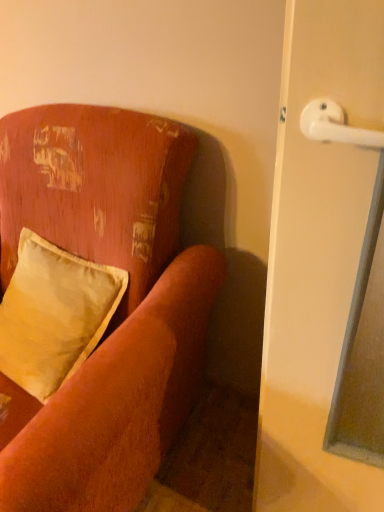
Question: From a real-world perspective, is velvet-like orange couch at upper left positioned over satin yellow pillow at left based on gravity?

Choices:
 (A) yes
 (B) no

Answer: (B)

Question: From the image's perspective, is velvet-like orange couch at upper left located beneath satin yellow pillow at left?

Choices:
 (A) yes
 (B) no

Answer: (A)

Question: Is velvet-like orange couch at upper left at the left side of satin yellow pillow at left?

Choices:
 (A) no
 (B) yes

Answer: (B)

Question: Can you confirm if velvet-like orange couch at upper left is shorter than satin yellow pillow at left?

Choices:
 (A) yes
 (B) no

Answer: (B)

Question: Does velvet-like orange couch at upper left have a smaller size compared to satin yellow pillow at left?

Choices:
 (A) yes
 (B) no

Answer: (B)

Question: Is velvet-like orange couch at upper left with satin yellow pillow at left?

Choices:
 (A) yes
 (B) no

Answer: (B)

Question: Does satin yellow pillow at left have a larger size compared to velvet-like orange couch at upper left?

Choices:
 (A) yes
 (B) no

Answer: (B)

Question: Does satin yellow pillow at left lie in front of velvet-like orange couch at upper left?

Choices:
 (A) no
 (B) yes

Answer: (A)

Question: Is satin yellow pillow at left shorter than velvet-like orange couch at upper left?

Choices:
 (A) no
 (B) yes

Answer: (B)

Question: From a real-world perspective, is satin yellow pillow at left positioned over velvet-like orange couch at upper left based on gravity?

Choices:
 (A) yes
 (B) no

Answer: (A)

Question: Is satin yellow pillow at left to the right of velvet-like orange couch at upper left from the viewer's perspective?

Choices:
 (A) yes
 (B) no

Answer: (A)

Question: Does satin yellow pillow at left have a smaller size compared to velvet-like orange couch at upper left?

Choices:
 (A) yes
 (B) no

Answer: (A)

Question: Is satin yellow pillow at left taller or shorter than velvet-like orange couch at upper left?

Choices:
 (A) short
 (B) tall

Answer: (A)